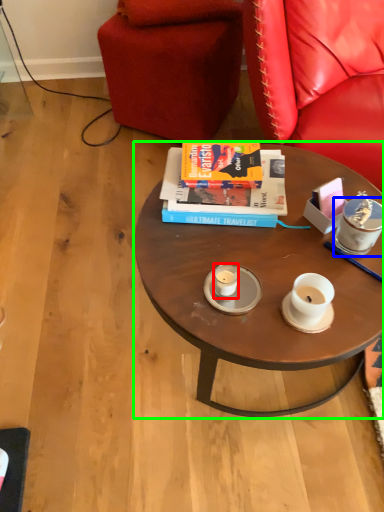
Question: Based on their relative distances, which object is nearer to coffee cup (highlighted by a red box)? Choose from coffee cup (highlighted by a blue box) and coffee table (highlighted by a green box).

Choices:
 (A) coffee cup
 (B) coffee table

Answer: (B)